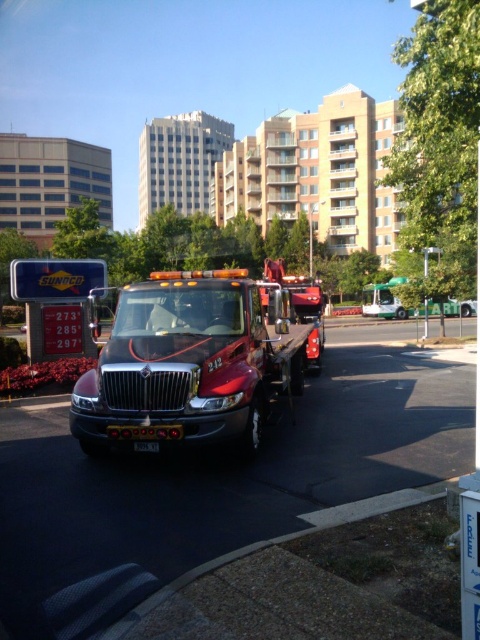
You are a photographer trying to capture both the shiny red tow truck at center and the black plastic license plate at center in a single shot. Which object should you focus on first to ensure both are in frame?

The shiny red tow truck at center is larger in size than the black plastic license plate at center, so you should focus on the shiny red tow truck at center first to ensure both are in frame.

Based on the photo, you are a delivery person trying to attach a package to the shiny red tow truck at center. The black plastic license plate at center is in the way. Can you place the package above the license plate but still on the truck?

The shiny red tow truck at center is above the black plastic license plate at center, so yes, you can place the package above the license plate but still on the truck since the truck is positioned higher than the license plate.

You are a delivery person trying to load a package onto the shiny red tow truck at center. The package requires that it must be placed above the black plastic license plate at center. Can you do this based on the scene?

The shiny red tow truck at center is much taller than the black plastic license plate at center, so yes, the package can be placed above the black plastic license plate at center.